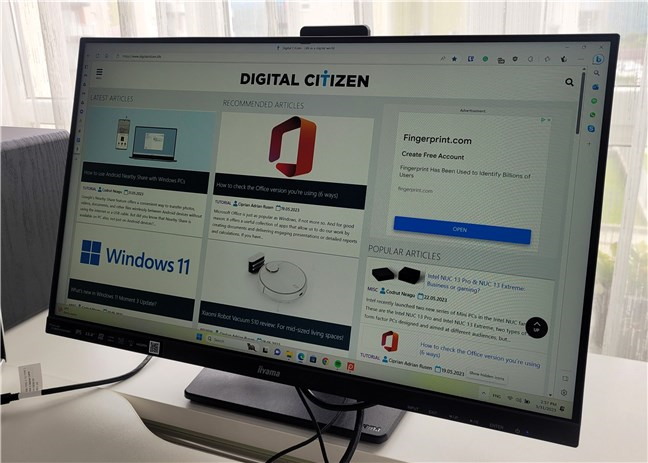
You are a GUI agent. You are given a task and a screenshot of the screen. Output one action in this format:
    pyautogui.click(x=<x>, y=<y>)
    Task: Click on the cords
    The width and height of the screenshot is (648, 463).
    Given the screenshot: What is the action you would take?
    pyautogui.click(x=341, y=408), pyautogui.click(x=349, y=442), pyautogui.click(x=314, y=439), pyautogui.click(x=291, y=442), pyautogui.click(x=118, y=378)